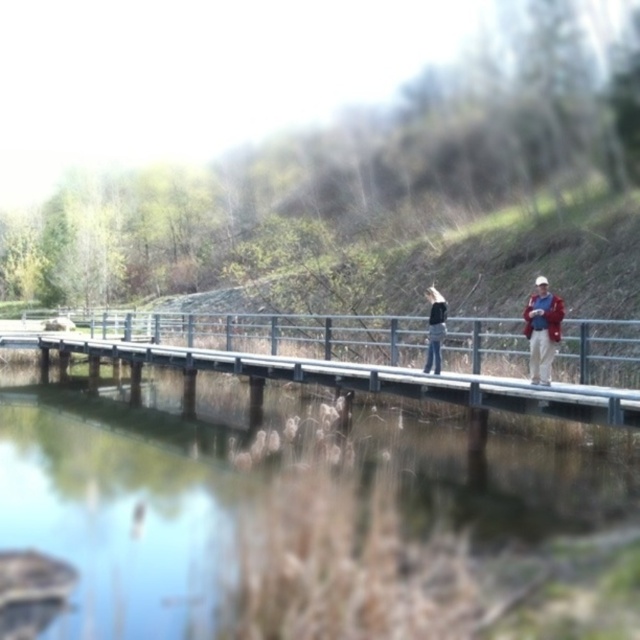
Who is higher up, matte black shirt at center or dark blue jeans at center?

matte black shirt at center

Can you confirm if matte black shirt at center is positioned to the left of dark blue jeans at center?

Incorrect, matte black shirt at center is not on the left side of dark blue jeans at center.

Is point (536, 353) farther from viewer compared to point (440, 301)?

No, (536, 353) is in front of (440, 301).

This screenshot has width=640, height=640. Identify the location of matte black shirt at center. (541, 330).

Is clear water at bridge center to the right of matte black shirt at center from the viewer's perspective?

Incorrect, clear water at bridge center is not on the right side of matte black shirt at center.

Does point (228, 554) come closer to viewer compared to point (531, 330)?

Yes, point (228, 554) is in front of point (531, 330).

Image resolution: width=640 pixels, height=640 pixels. I want to click on clear water at bridge center, so click(x=305, y=518).

Between metallic gray bridge at center and red jacket at right, which one has less height?

red jacket at right is shorter.

Is metallic gray bridge at center positioned at the back of red jacket at right?

No, it is in front of red jacket at right.

Between point (289, 336) and point (529, 332), which one is positioned in front?

Point (529, 332) is in front.

Where is `metallic gray bridge at center`? This screenshot has width=640, height=640. metallic gray bridge at center is located at coordinates (385, 356).